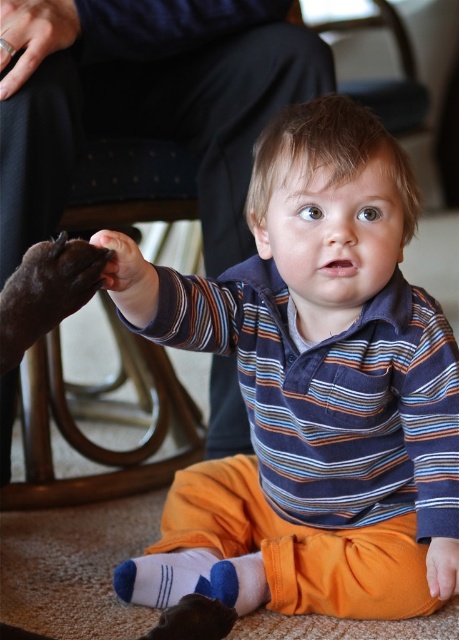
Question: Which object is closer to the camera taking this photo?

Choices:
 (A) orange fabric foot at lower right
 (B) matte black paw at center
 (C) metallic ring at upper left

Answer: (B)

Question: Estimate the real-world distances between objects in this image. Which object is farther from the black fur paw at left?

Choices:
 (A) striped cotton shirt at center
 (B) orange fabric foot at lower right
 (C) metallic ring at upper left
 (D) white soft sock at lower center

Answer: (B)

Question: Which of the following is the farthest from the observer?

Choices:
 (A) (283, 467)
 (B) (1, 364)

Answer: (A)

Question: Does striped cotton shirt at center appear over metallic ring at upper left?

Choices:
 (A) no
 (B) yes

Answer: (A)

Question: Can you confirm if striped cotton shirt at center is positioned above black fur paw at left?

Choices:
 (A) no
 (B) yes

Answer: (A)

Question: In this image, where is striped cotton shirt at center located relative to metallic ring at upper left?

Choices:
 (A) below
 (B) above

Answer: (A)